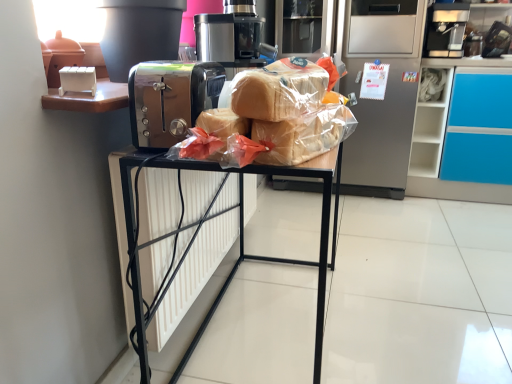
Question: Is silver metallic refrigerator at center at the right side of satin chrome toaster at center?

Choices:
 (A) no
 (B) yes

Answer: (B)

Question: Does silver metallic refrigerator at center have a greater height compared to satin chrome toaster at center?

Choices:
 (A) yes
 (B) no

Answer: (A)

Question: Is silver metallic refrigerator at center next to satin chrome toaster at center?

Choices:
 (A) yes
 (B) no

Answer: (B)

Question: From a real-world perspective, is silver metallic refrigerator at center on satin chrome toaster at center?

Choices:
 (A) yes
 (B) no

Answer: (B)

Question: Can you confirm if silver metallic refrigerator at center is thinner than satin chrome toaster at center?

Choices:
 (A) yes
 (B) no

Answer: (B)

Question: Is silver metallic refrigerator at center far away from satin chrome toaster at center?

Choices:
 (A) yes
 (B) no

Answer: (A)

Question: Are black plastic coffee machine at upper right and translucent plastic bread at center beside each other?

Choices:
 (A) no
 (B) yes

Answer: (A)

Question: Does black plastic coffee machine at upper right have a lesser width compared to translucent plastic bread at center?

Choices:
 (A) no
 (B) yes

Answer: (A)

Question: Considering the relative positions of black plastic coffee machine at upper right and translucent plastic bread at center in the image provided, is black plastic coffee machine at upper right to the right of translucent plastic bread at center from the viewer's perspective?

Choices:
 (A) yes
 (B) no

Answer: (A)

Question: Is black plastic coffee machine at upper right oriented away from translucent plastic bread at center?

Choices:
 (A) yes
 (B) no

Answer: (B)

Question: Could you tell me if black plastic coffee machine at upper right is turned towards translucent plastic bread at center?

Choices:
 (A) no
 (B) yes

Answer: (B)

Question: Is black plastic coffee machine at upper right positioned before translucent plastic bread at center?

Choices:
 (A) no
 (B) yes

Answer: (A)

Question: Could you tell me if metallic black toaster at center is turned towards silver metallic refrigerator at center?

Choices:
 (A) yes
 (B) no

Answer: (B)